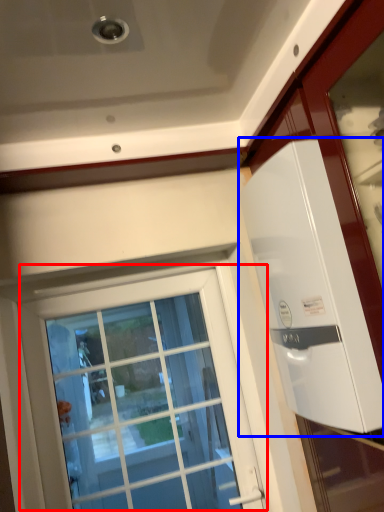
Question: Which of the following is the closest to the observer, window (highlighted by a red box) or appliance (highlighted by a blue box)?

Choices:
 (A) window
 (B) appliance

Answer: (B)